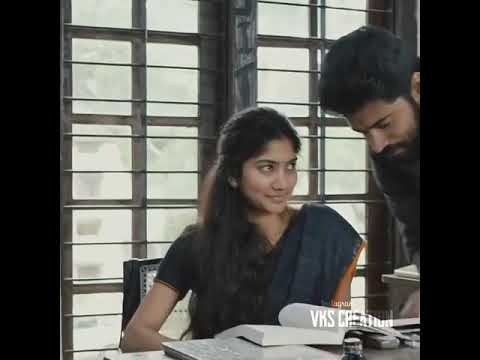
The width and height of the screenshot is (480, 360). Find the location of `bottle`. bottle is located at coordinates (356, 354).